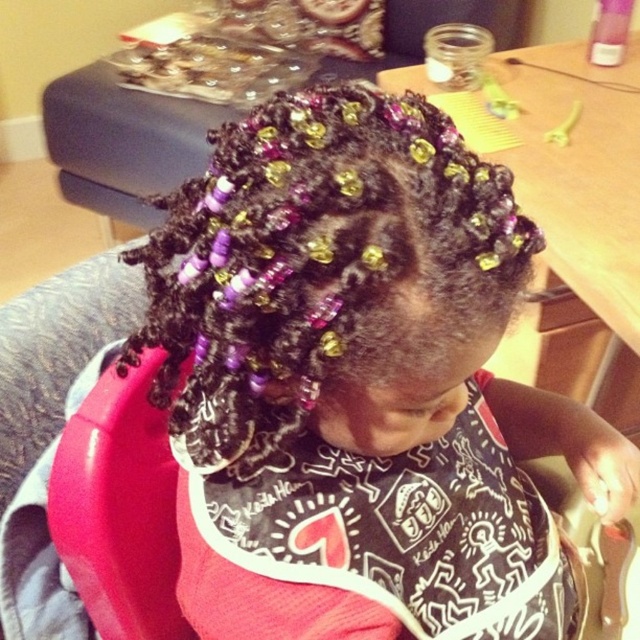
Based on the photo, the child in the image is wearing a bib and has beads in their hair. From the perspective of someone looking directly at the child, which object is closer to the viewer between the purple beaded hair at center and the black printed bib at center?

The purple beaded hair at center is in front of the black printed bib at center, so it is closer to the viewer.

You are a photographer taking a picture of the child. The purple beaded hair at center and the black printed bib at center are both important elements. Which one is covering the other?

The purple beaded hair at center is positioned over the black printed bib at center, so it is covering the bib.

The child in the image is wearing a black printed bib at center and has purple beaded hair at center. Which of these is shorter?

The purple beaded hair at center is shorter than the black printed bib at center.